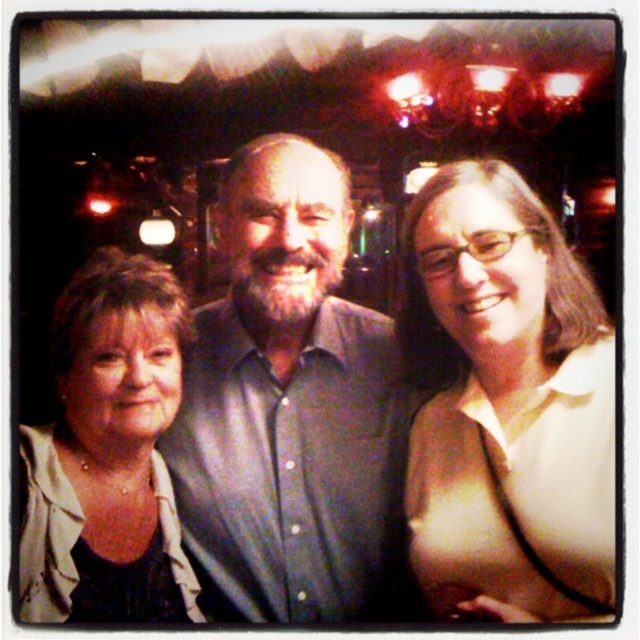
Is point (273, 301) farther from viewer compared to point (273, 189)?

No.

Describe the element at coordinates (291, 410) in the screenshot. I see `green matte shirt at center` at that location.

Find the location of a particular element. green matte shirt at center is located at coordinates (291, 410).

Can you confirm if matte green shirt at center is smaller than matte beige jacket at lower left?

No.

Does matte green shirt at center have a larger size compared to matte beige jacket at lower left?

Yes.

Is point (339, 307) closer to viewer compared to point (164, 474)?

No, (339, 307) is further to viewer.

I want to click on matte green shirt at center, so click(285, 243).

Does point (396, 394) come farther from viewer compared to point (525, 579)?

Yes.

This screenshot has height=640, width=640. I want to click on green matte shirt at center, so click(291, 410).

Does point (355, 516) lie in front of point (513, 541)?

No.

Where is `green matte shirt at center`? green matte shirt at center is located at coordinates tap(291, 410).